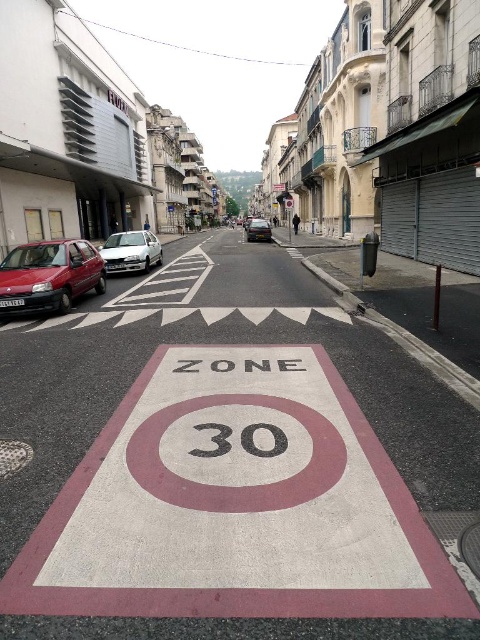
Question: Which point is farther from the camera taking this photo?

Choices:
 (A) (248, 225)
 (B) (23, 275)

Answer: (A)

Question: Can you confirm if matte red car at left is smaller than black textured number at center?

Choices:
 (A) yes
 (B) no

Answer: (B)

Question: Is matte red car at left closer to camera compared to shiny black car at center?

Choices:
 (A) yes
 (B) no

Answer: (A)

Question: Which of the following is the closest to the observer?

Choices:
 (A) (253, 445)
 (B) (22, 284)
 (C) (120, 250)

Answer: (A)

Question: Among these objects, which one is farthest from the camera?

Choices:
 (A) matte red car at left
 (B) shiny black car at center

Answer: (B)

Question: From the image, what is the correct spatial relationship of white concrete bike lane at center in relation to black textured number at center?

Choices:
 (A) right
 (B) left

Answer: (A)